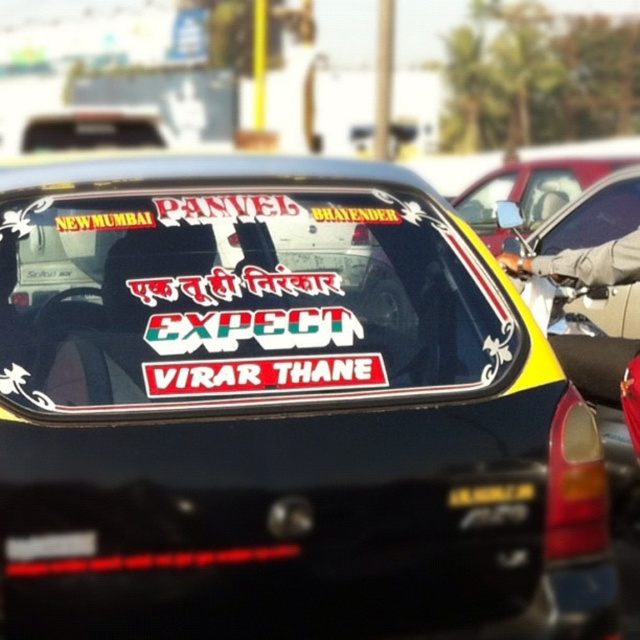
You are a passenger in the car and want to know which sticker on the rear window is larger. Can you determine which one is bigger between the matte vinyl sticker at center and the white matte sticker at center?

The matte vinyl sticker at center is bigger than the white matte sticker at center.

You are a passenger in a car and want to know the exact location of the matte vinyl sticker at center on the car window. Can you tell me its coordinates?

The matte vinyl sticker at center is located at coordinates point (240,301).

You are a passenger in the car and want to know the order of the destinations displayed on the rear window. The destinations are marked as point 1 at coordinates point (x=342, y=380) and point 2 at coordinates point (x=541, y=212). Which destination point is closer to the front of the car?

Point 1 at coordinates point (x=342, y=380) is closer to the front of the car because it is in front of point 2 at coordinates point (x=541, y=212).